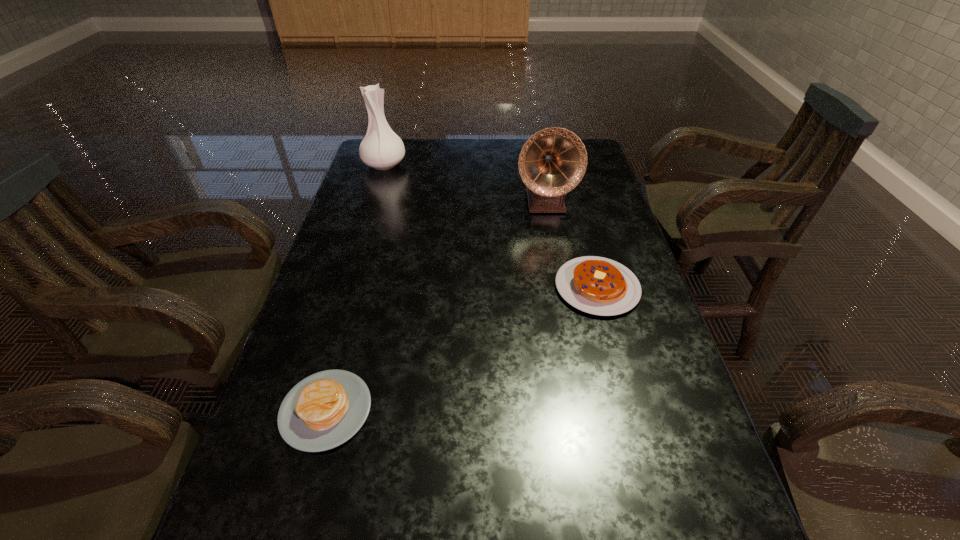
This screenshot has width=960, height=540. Find the location of `free space between the farthest object and the farther pancake`. free space between the farthest object and the farther pancake is located at coordinates (491, 226).

Where is `unoccupied area between the left pancake and the right pancake`? unoccupied area between the left pancake and the right pancake is located at coordinates click(x=462, y=349).

This screenshot has height=540, width=960. I want to click on vacant area that lies between the phonograph record and the right pancake, so click(x=571, y=245).

Image resolution: width=960 pixels, height=540 pixels. I want to click on free space between the second farthest object and the third farthest object, so click(x=571, y=245).

Find the location of `vacant space in between the nearer pancake and the farther pancake`. vacant space in between the nearer pancake and the farther pancake is located at coordinates (462, 349).

Find the location of a particular element. The image size is (960, 540). empty space between the left pancake and the vase is located at coordinates (355, 287).

Image resolution: width=960 pixels, height=540 pixels. Find the location of `vacant area that lies between the farthest object and the left pancake`. vacant area that lies between the farthest object and the left pancake is located at coordinates (355, 287).

Identify the location of vacant space that is in between the vase and the phonograph record. (465, 184).

The width and height of the screenshot is (960, 540). I want to click on vacant space that is in between the farthest object and the nearest object, so click(x=355, y=287).

At what (x,y) coordinates should I click in order to perform the action: click on object that is the closest one to the phonograph record. Please return your answer as a coordinate pair (x, y). The width and height of the screenshot is (960, 540). Looking at the image, I should click on (600, 286).